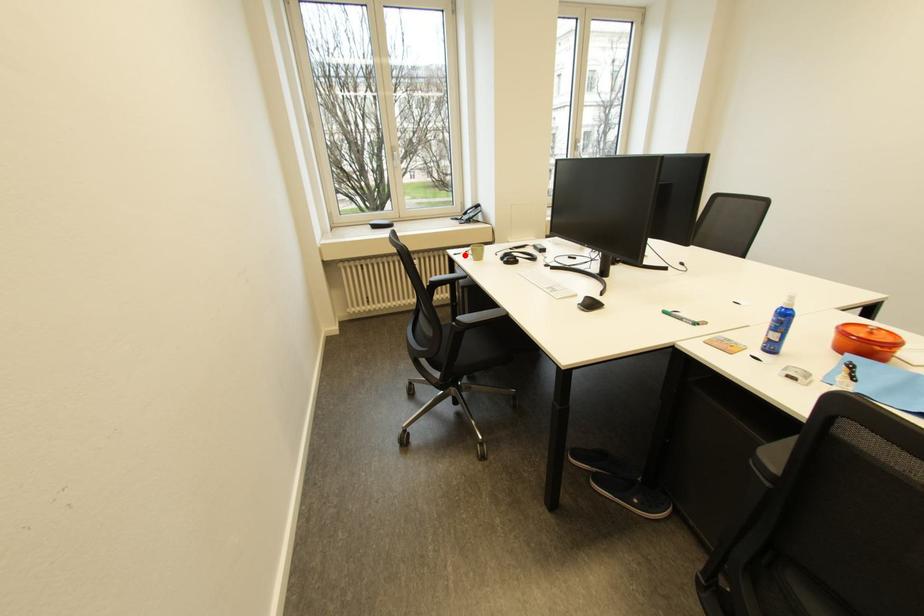
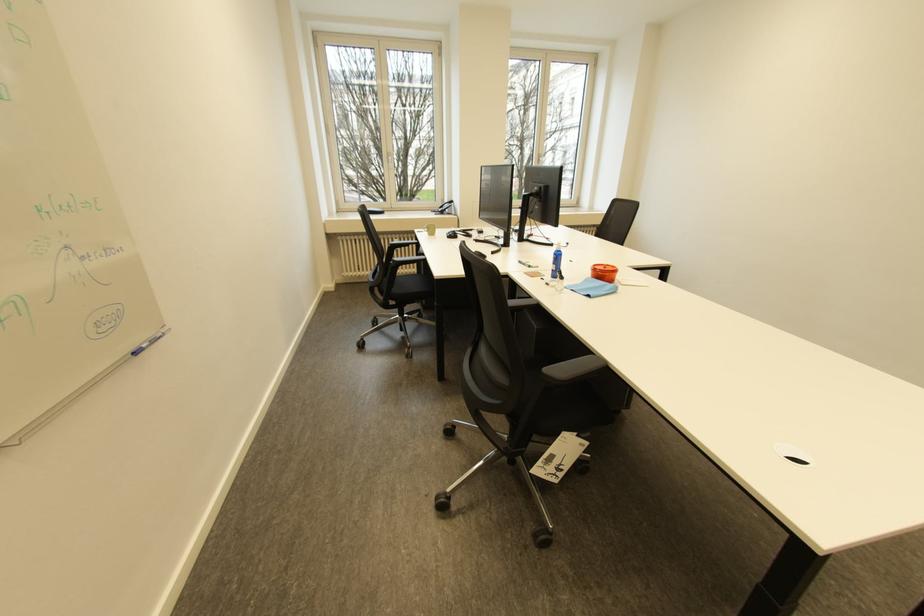
The point at the highlighted location is marked in the first image. Where is the corresponding point in the second image?

(428, 233)